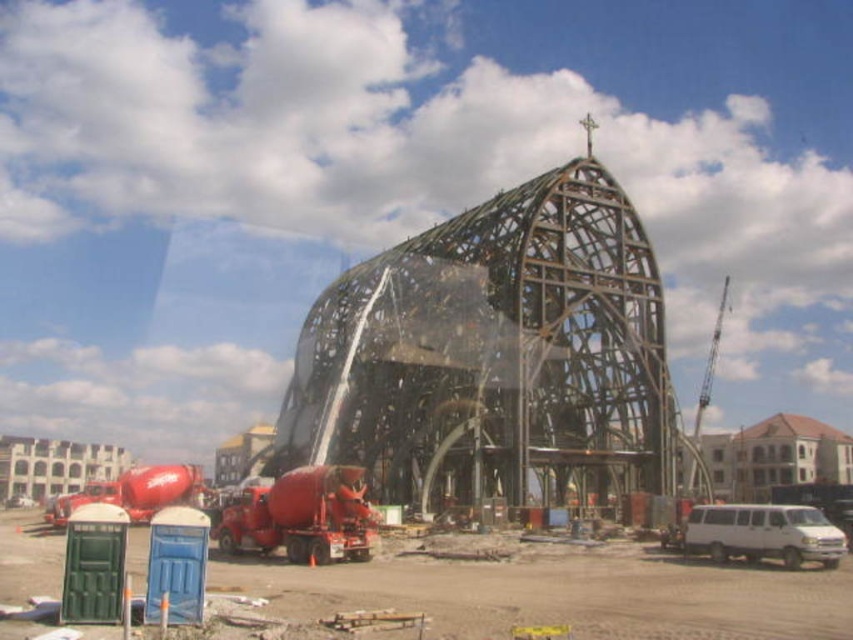
Question: Does metallic framework at center have a larger size compared to green plastic port-a-potty at lower left?

Choices:
 (A) yes
 (B) no

Answer: (A)

Question: Does green plastic port-a-potty at lower left appear under white matte van at lower right?

Choices:
 (A) no
 (B) yes

Answer: (A)

Question: Which is farther from the white matte van at lower right?

Choices:
 (A) metallic framework at center
 (B) green plastic port-a-potty at lower left

Answer: (A)

Question: Is metallic framework at center wider than white matte van at lower right?

Choices:
 (A) yes
 (B) no

Answer: (A)

Question: Which object appears farthest from the camera in this image?

Choices:
 (A) green plastic port-a-potty at lower left
 (B) metallic framework at center

Answer: (B)

Question: Considering the real-world distances, which object is closest to the green plastic port-a-potty at lower left?

Choices:
 (A) white matte van at lower right
 (B) metallic framework at center

Answer: (A)